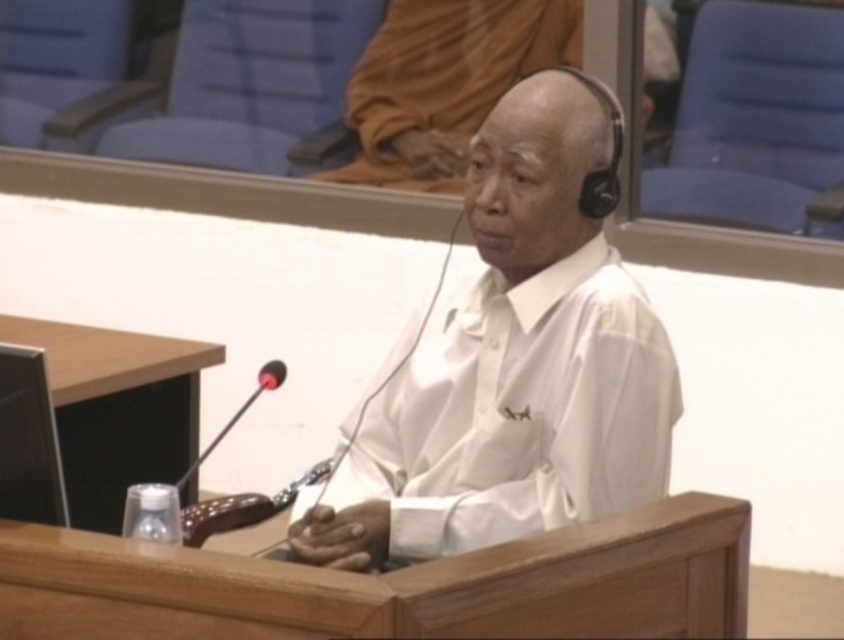
Who is positioned more to the left, white matte shirt at center or black plastic microphone at lower center?

From the viewer's perspective, black plastic microphone at lower center appears more on the left side.

Which of these two, white matte shirt at center or black plastic microphone at lower center, stands taller?

Standing taller between the two is white matte shirt at center.

Between point (629, 428) and point (181, 474), which one is positioned behind?

The point (181, 474) is behind.

The height and width of the screenshot is (640, 844). I want to click on white matte shirt at center, so click(x=512, y=365).